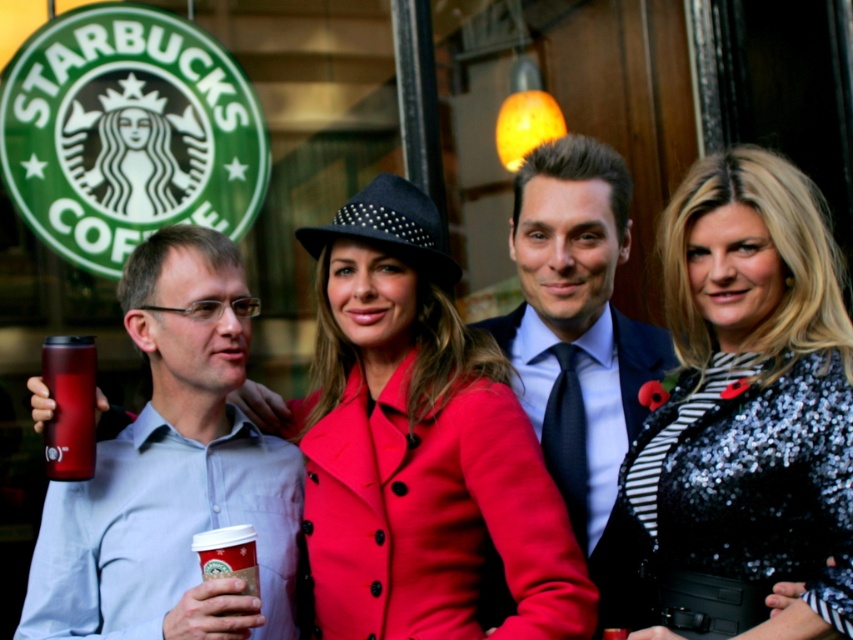
You are a barista at Starbucks who needs to place the matte plastic cup at left and the matte red tumbler at left on a shelf. The shelf is 25 inches wide. Can both items fit side by side on the shelf without overlapping?

The matte plastic cup at left is 30.56 inches from the matte red tumbler at left. Since the distance between them is greater than the shelf width of 25 inches, they cannot fit side by side on the shelf without overlapping.

What is located at the coordinate point (173,472) in the image?

The matte plastic cup at left is located at the coordinate point (173,472).

What is the 2D coordinate of the matte red coat at center?

The matte red coat at center is located at the 2D coordinate point of (416, 445).